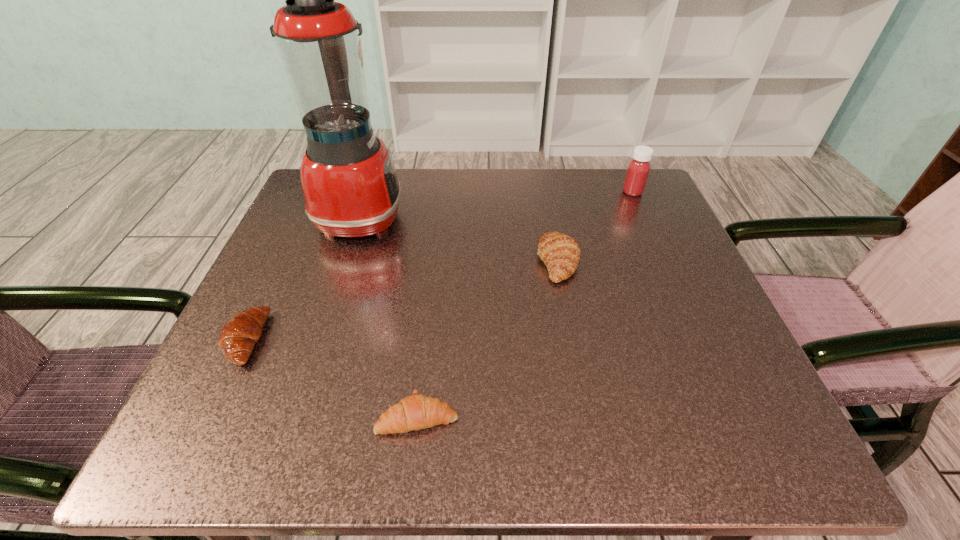
I want to click on free space between the food processor and the shortest object, so click(x=389, y=316).

Find the location of a particular element. empty location between the third tallest object and the tallest object is located at coordinates (459, 239).

Locate an element on the screen. free space between the tallest crescent roll and the fourth farthest object is located at coordinates 401,300.

The image size is (960, 540). I want to click on vacant area that lies between the shortest object and the tallest object, so click(389, 316).

Locate an element on the screen. empty location between the nearest crescent roll and the food processor is located at coordinates (389, 316).

The width and height of the screenshot is (960, 540). Find the location of `free space between the rightmost object and the food processor`. free space between the rightmost object and the food processor is located at coordinates (496, 204).

Find the location of a particular element. The height and width of the screenshot is (540, 960). free space that is in between the leftmost crescent roll and the second object from right to left is located at coordinates (401, 300).

This screenshot has width=960, height=540. Identify the location of empty space between the nearest crescent roll and the fourth shortest object. (525, 304).

Where is `the third closest object to the farthest crescent roll`? the third closest object to the farthest crescent roll is located at coordinates 349,182.

Choose which object is the fourth nearest neighbor to the farthest crescent roll. Please provide its 2D coordinates. Your answer should be formatted as a tuple, i.e. [(x, y)], where the tuple contains the x and y coordinates of a point satisfying the conditions above.

[(240, 333)]